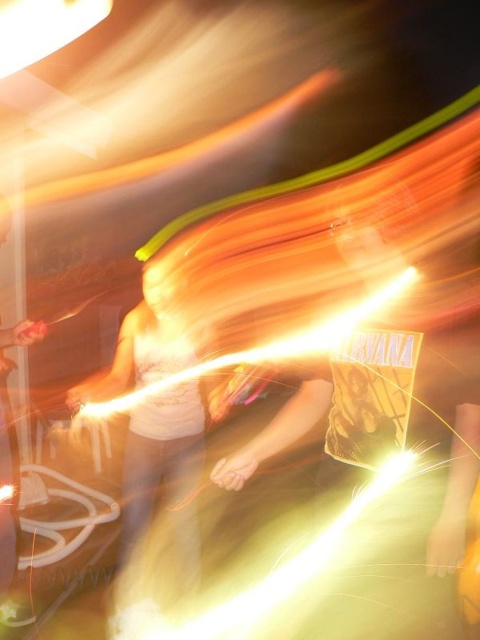
How much distance is there between white cotton shirt at center and metallic silver fork at left?

white cotton shirt at center is 17.89 inches away from metallic silver fork at left.

Is point (132, 488) positioned before point (13, 492)?

Yes, it is.

Find the location of a particular element. This screenshot has width=480, height=640. white cotton shirt at center is located at coordinates (163, 467).